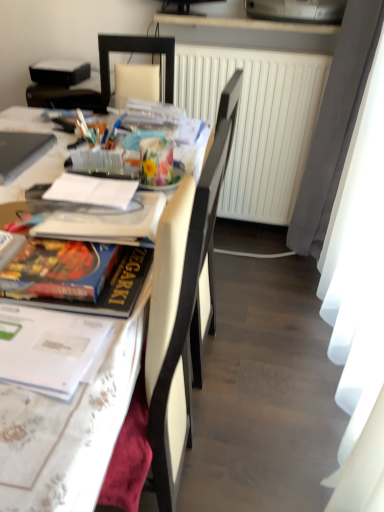
Question: Does floral-patterned paper at center contain hardcover book at left, which is the 1th magazine in bottom-to-top order?

Choices:
 (A) yes
 (B) no

Answer: (B)

Question: Is floral-patterned paper at center smaller than hardcover book at left, positioned as the third magazine in top-to-bottom order?

Choices:
 (A) yes
 (B) no

Answer: (A)

Question: Considering the relative sizes of floral-patterned paper at center and hardcover book at left, the first magazine from the front, in the image provided, is floral-patterned paper at center wider than hardcover book at left, the first magazine from the front,?

Choices:
 (A) yes
 (B) no

Answer: (B)

Question: Does floral-patterned paper at center have a lesser width compared to hardcover book at left, which is the 1th magazine in bottom-to-top order?

Choices:
 (A) no
 (B) yes

Answer: (B)

Question: Does floral-patterned paper at center come behind hardcover book at left, which is the 1th magazine in bottom-to-top order?

Choices:
 (A) no
 (B) yes

Answer: (B)

Question: Is floral-patterned paper at center taller than hardcover book at left, which ranks as the 3th magazine in back-to-front order?

Choices:
 (A) yes
 (B) no

Answer: (A)

Question: Is white matte radiator at center further to the viewer compared to white leather chair at center?

Choices:
 (A) yes
 (B) no

Answer: (A)

Question: Is white matte radiator at center surrounding white leather chair at center?

Choices:
 (A) yes
 (B) no

Answer: (B)

Question: From a real-world perspective, is white matte radiator at center positioned over white leather chair at center based on gravity?

Choices:
 (A) no
 (B) yes

Answer: (B)

Question: Are white matte radiator at center and white leather chair at center making contact?

Choices:
 (A) no
 (B) yes

Answer: (A)

Question: Considering the relative sizes of white matte radiator at center and white leather chair at center in the image provided, is white matte radiator at center smaller than white leather chair at center?

Choices:
 (A) no
 (B) yes

Answer: (B)

Question: Is white matte radiator at center thinner than white leather chair at center?

Choices:
 (A) no
 (B) yes

Answer: (B)

Question: Is white glossy table at left positioned with its back to white matte radiator at center?

Choices:
 (A) no
 (B) yes

Answer: (A)